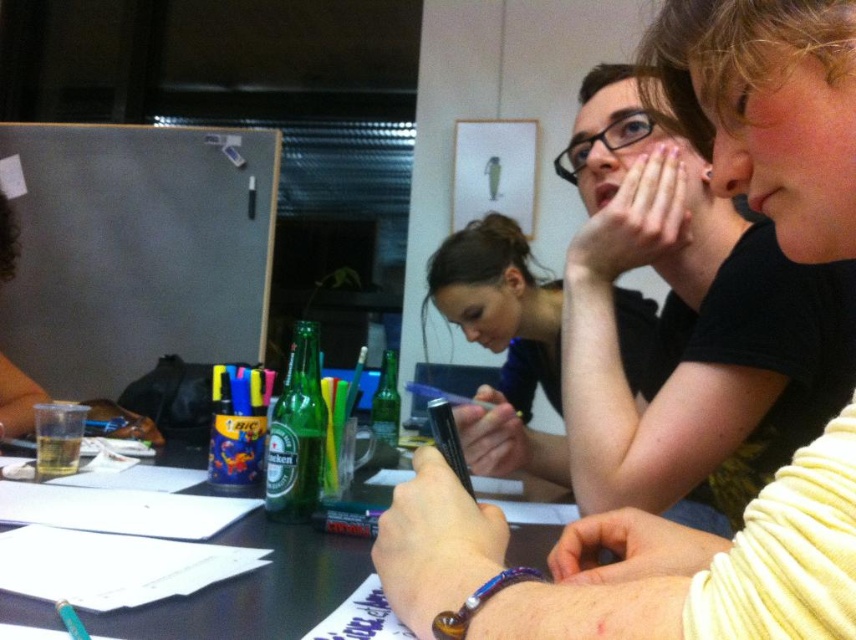
Who is more distant from viewer, (724, 189) or (724, 243)?

The point (724, 243) is behind.

Locate an element on the screen. This screenshot has height=640, width=856. matte black pen at center is located at coordinates (634, 563).

Between point (462, 605) and point (622, 225), which one is positioned behind?

Positioned behind is point (622, 225).

Identify the location of matte black pen at center. (634, 563).

Does matte black pen at center appear over smooth black shirt at center?

Indeed, matte black pen at center is positioned over smooth black shirt at center.

Does matte black pen at center appear on the right side of smooth black shirt at center?

Incorrect, matte black pen at center is not on the right side of smooth black shirt at center.

Who is more forward, (824, 588) or (544, 346)?

Point (824, 588) is more forward.

The width and height of the screenshot is (856, 640). I want to click on matte black pen at center, so click(x=634, y=563).

Measure the distance between smooth black shirt at upper right and smooth black shirt at center.

smooth black shirt at upper right and smooth black shirt at center are 14.26 inches apart.

Is point (663, 182) positioned after point (544, 458)?

No, it is not.

Locate an element on the screen. smooth black shirt at upper right is located at coordinates (696, 340).